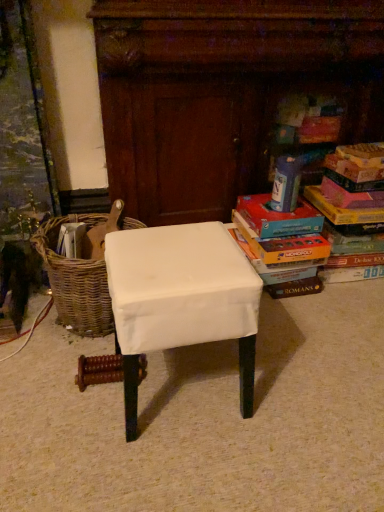
Identify the location of matte cardboard book at right, which ranks as the second book in right-to-left order. The width and height of the screenshot is (384, 512). (283, 244).

The width and height of the screenshot is (384, 512). Describe the element at coordinates (352, 212) in the screenshot. I see `multicolored cardboard books at right, which ranks as the 2th book in left-to-right order` at that location.

Locate an element on the screen. Image resolution: width=384 pixels, height=512 pixels. hardcover book at upper right is located at coordinates (286, 183).

Between white fabric-covered stool at center and woven brown basket at left, which one is positioned behind?

woven brown basket at left.

Is there a large distance between white fabric-covered stool at center and woven brown basket at left?

Actually, white fabric-covered stool at center and woven brown basket at left are a little close together.

Measure the distance from white fabric-covered stool at center to woven brown basket at left.

The distance of white fabric-covered stool at center from woven brown basket at left is 35.88 centimeters.

Which is farther, (x=221, y=249) or (x=92, y=296)?

The point (x=92, y=296) is farther from the camera.

Could you tell me if multicolored cardboard books at right, the 1th book viewed from the right, is turned towards white fabric-covered stool at center?

No, multicolored cardboard books at right, the 1th book viewed from the right, is not facing towards white fabric-covered stool at center.

This screenshot has width=384, height=512. I want to click on the 2nd book to the right when counting from the white fabric-covered stool at center, so click(x=352, y=212).

Is the position of multicolored cardboard books at right, the 1th book viewed from the right, less distant than that of white fabric-covered stool at center?

No, it is behind white fabric-covered stool at center.

From the image's perspective, is multicolored cardboard books at right, which ranks as the 2th book in left-to-right order, over white fabric-covered stool at center?

Correct, multicolored cardboard books at right, which ranks as the 2th book in left-to-right order, appears higher than white fabric-covered stool at center in the image.

Is multicolored cardboard books at right, the 1th book viewed from the right, in front of or behind hardcover book at upper right in the image?

multicolored cardboard books at right, the 1th book viewed from the right, is in front of hardcover book at upper right.

From the image's perspective, is multicolored cardboard books at right, which ranks as the 2th book in left-to-right order, above or below hardcover book at upper right?

From the image's perspective, multicolored cardboard books at right, which ranks as the 2th book in left-to-right order, appears below hardcover book at upper right.

Is multicolored cardboard books at right, which ranks as the 2th book in left-to-right order, aimed at hardcover book at upper right?

No, multicolored cardboard books at right, which ranks as the 2th book in left-to-right order, is not turned towards hardcover book at upper right.

Starting from the hardcover book at upper right, which book is the 1st one in front? Please provide its 2D coordinates.

[(352, 212)]

From a real-world perspective, which object stands above the other?

multicolored cardboard books at right, the 1th book viewed from the right.

Between point (329, 261) and point (256, 260), which one is positioned in front?

The point (256, 260) is more forward.

Is multicolored cardboard books at right, which ranks as the 2th book in left-to-right order, in contact with matte cardboard book at right, the first book positioned from the left?

No, multicolored cardboard books at right, which ranks as the 2th book in left-to-right order, is not making contact with matte cardboard book at right, the first book positioned from the left.

Find the location of a particular element. The height and width of the screenshot is (512, 384). book behind the matte cardboard book at right, the first book positioned from the left is located at coordinates (352, 212).

Is woven brown basket at left oriented towards multicolored cardboard books at right, which ranks as the 2th book in left-to-right order?

No, woven brown basket at left is not facing towards multicolored cardboard books at right, which ranks as the 2th book in left-to-right order.

From a real-world perspective, between woven brown basket at left and multicolored cardboard books at right, which ranks as the 2th book in left-to-right order, who is vertically higher?

multicolored cardboard books at right, which ranks as the 2th book in left-to-right order.

Could you measure the distance between woven brown basket at left and multicolored cardboard books at right, which ranks as the 2th book in left-to-right order?

woven brown basket at left is 96.37 centimeters away from multicolored cardboard books at right, which ranks as the 2th book in left-to-right order.

From the picture: Considering the relative sizes of woven brown basket at left and multicolored cardboard books at right, the 1th book viewed from the right, in the image provided, is woven brown basket at left taller than multicolored cardboard books at right, the 1th book viewed from the right,?

Incorrect, the height of woven brown basket at left is not larger of that of multicolored cardboard books at right, the 1th book viewed from the right.

Is hardcover book at upper right to the left of multicolored cardboard books at right, the 1th book viewed from the right, from the viewer's perspective?

Correct, you'll find hardcover book at upper right to the left of multicolored cardboard books at right, the 1th book viewed from the right.

Which is correct: hardcover book at upper right is inside multicolored cardboard books at right, the 1th book viewed from the right, or outside of it?

hardcover book at upper right is located beyond the bounds of multicolored cardboard books at right, the 1th book viewed from the right.

How many degrees apart are the facing directions of hardcover book at upper right and multicolored cardboard books at right, the 1th book viewed from the right?

hardcover book at upper right and multicolored cardboard books at right, the 1th book viewed from the right, are facing 1.68 degrees away from each other.

Is multicolored cardboard books at right, the 1th book viewed from the right, at the back of hardcover book at upper right?

hardcover book at upper right is not turned away from multicolored cardboard books at right, the 1th book viewed from the right.

Which is further, (301, 173) or (293, 286)?

Point (293, 286)

Could you tell me if hardcover book at upper right is turned towards matte cardboard book at right, which ranks as the second book in right-to-left order?

No, hardcover book at upper right is not aimed at matte cardboard book at right, which ranks as the second book in right-to-left order.

From the picture: Is hardcover book at upper right beside matte cardboard book at right, which ranks as the second book in right-to-left order?

No, hardcover book at upper right is not touching matte cardboard book at right, which ranks as the second book in right-to-left order.

Which of these two, hardcover book at upper right or matte cardboard book at right, the first book positioned from the left, stands taller?

matte cardboard book at right, the first book positioned from the left, is taller.

Locate an element on the screen. stool located above the woven brown basket at left (from a real-world perspective) is located at coordinates (181, 298).

In the image, there is a multicolored cardboard books at right, which ranks as the 2th book in left-to-right order. Where is `stool below it (from the image's perspective)`? stool below it (from the image's perspective) is located at coordinates (181, 298).

Based on their spatial positions, is woven brown basket at left or multicolored cardboard books at right, the 1th book viewed from the right, closer to hardcover book at upper right?

multicolored cardboard books at right, the 1th book viewed from the right.

Based on their spatial positions, is multicolored cardboard books at right, the 1th book viewed from the right, or hardcover book at upper right closer to white fabric-covered stool at center?

hardcover book at upper right is positioned closer to the anchor white fabric-covered stool at center.

In the scene shown: Based on their spatial positions, is white fabric-covered stool at center or matte cardboard book at right, which ranks as the second book in right-to-left order, closer to multicolored cardboard books at right, the 1th book viewed from the right?

Based on the image, matte cardboard book at right, which ranks as the second book in right-to-left order, appears to be nearer to multicolored cardboard books at right, the 1th book viewed from the right.

Which object lies nearer to the anchor point matte cardboard book at right, which ranks as the second book in right-to-left order, white fabric-covered stool at center or multicolored cardboard books at right, which ranks as the 2th book in left-to-right order?

Among the two, multicolored cardboard books at right, which ranks as the 2th book in left-to-right order, is located nearer to matte cardboard book at right, which ranks as the second book in right-to-left order.

Considering their positions, is woven brown basket at left positioned further to hardcover book at upper right than white fabric-covered stool at center?

Among the two, woven brown basket at left is located further to hardcover book at upper right.

Looking at the image, which one is located further to hardcover book at upper right, woven brown basket at left or matte cardboard book at right, which ranks as the second book in right-to-left order?

woven brown basket at left is further to hardcover book at upper right.

Which object lies nearer to the anchor point matte cardboard book at right, which ranks as the second book in right-to-left order, multicolored cardboard books at right, the 1th book viewed from the right, or woven brown basket at left?

Among the two, multicolored cardboard books at right, the 1th book viewed from the right, is located nearer to matte cardboard book at right, which ranks as the second book in right-to-left order.

Which object lies nearer to the anchor point matte cardboard book at right, the first book positioned from the left, multicolored cardboard books at right, which ranks as the 2th book in left-to-right order, or hardcover book at upper right?

hardcover book at upper right lies closer to matte cardboard book at right, the first book positioned from the left, than the other object.

Locate an element on the screen. Image resolution: width=384 pixels, height=512 pixels. book between white fabric-covered stool at center and multicolored cardboard books at right, which ranks as the 2th book in left-to-right order, from left to right is located at coordinates (283, 244).

Identify the location of book between woven brown basket at left and hardcover book at upper right. (283, 244).

The width and height of the screenshot is (384, 512). What are the coordinates of `stool between woven brown basket at left and multicolored cardboard books at right, the 1th book viewed from the right, from left to right` in the screenshot? It's located at (181, 298).

You are a GUI agent. You are given a task and a screenshot of the screen. Output one action in this format:
    pyautogui.click(x=<x>, y=<y>)
    Task: Click on the book between woven brown basket at left and multicolored cardboard books at right, which ranks as the 2th book in left-to-right order, in the horizontal direction
    The height and width of the screenshot is (512, 384).
    Given the screenshot: What is the action you would take?
    pyautogui.click(x=283, y=244)